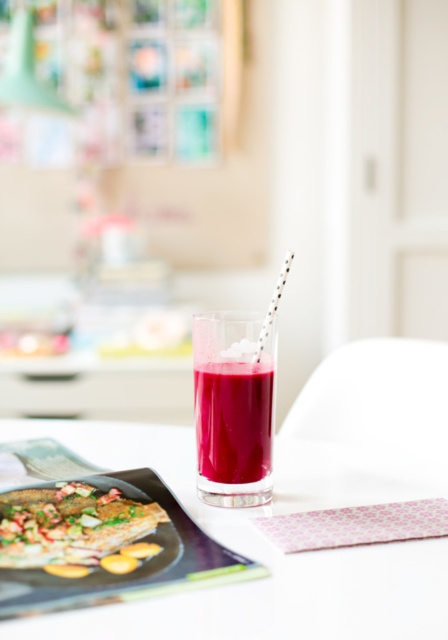
You are a food stylist arranging items on a kitchen table. You have a matte glass platter at center and a silver metallic straw at center. According to the scene, which object is positioned to the left of the other?

The matte glass platter at center is to the left of the silver metallic straw at center.

You are a food stylist who needs to place a new dish on the matte glass platter at center. The dish requires 15 cm of vertical space. Can the shiny silver fish at center currently on the platter accommodate this requirement?

The matte glass platter at center is much taller as shiny silver fish at center, so the vertical space provided by the platter is sufficient to accommodate the dish requiring 15 cm of vertical space.

You are a chef preparing to serve a dish. You have a matte glass platter at center and a silver metallic straw at center in front of you. Which object is closer to you?

The matte glass platter at center is closer because it is in front of the silver metallic straw at center.